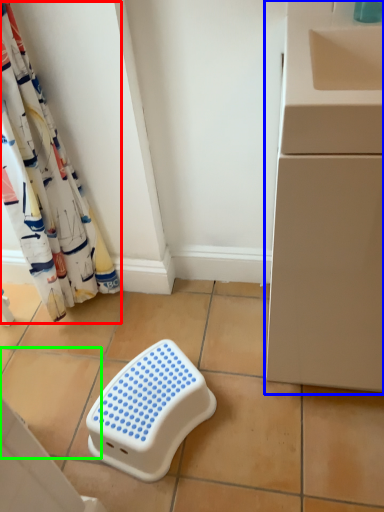
Question: Considering the real-world distances, which object is closest to curtain (highlighted by a red box)? counter (highlighted by a blue box) or ceramic tile (highlighted by a green box).

Choices:
 (A) counter
 (B) ceramic tile

Answer: (B)